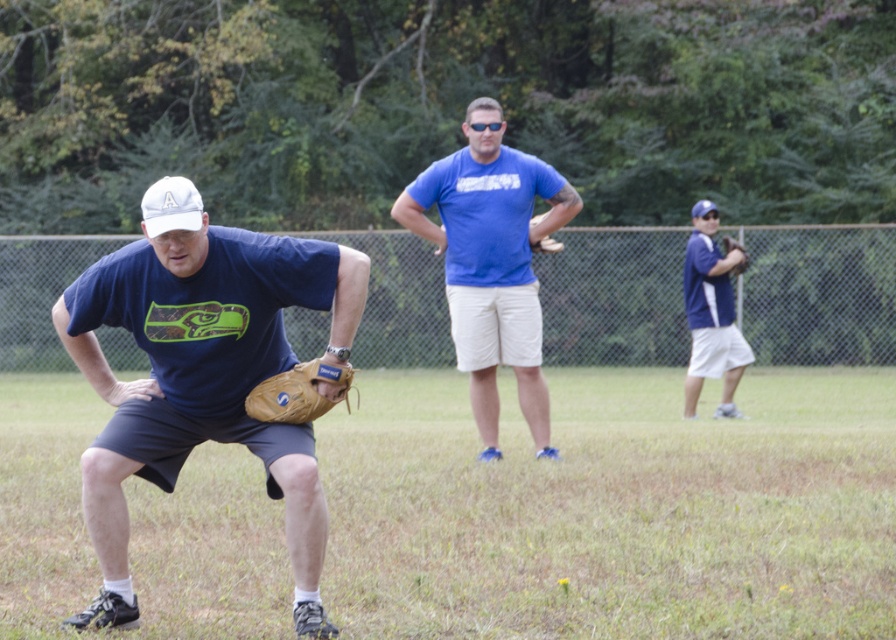
Between brown leather baseball glove at center and brown leather glove at center, which one is positioned higher?

brown leather glove at center is above.

Does brown leather baseball glove at center have a smaller size compared to brown leather glove at center?

Yes.

Locate an element on the screen. This screenshot has width=896, height=640. brown leather baseball glove at center is located at coordinates (297, 392).

Who is taller, dark blue baseball glove at center or white matte baseball cap at left?

white matte baseball cap at left

Does point (165, 586) come behind point (186, 212)?

Yes, it is.

The height and width of the screenshot is (640, 896). Find the location of `dark blue baseball glove at center`. dark blue baseball glove at center is located at coordinates (614, 508).

Find the location of `dark blue baseball glove at center`. dark blue baseball glove at center is located at coordinates pyautogui.click(x=614, y=508).

How much distance is there between matte blue t-shirt at left and blue cotton shirt at center?

They are 4.17 meters apart.

In the scene shown: Is matte blue t-shirt at left positioned in front of blue cotton shirt at center?

That is True.

You are a GUI agent. You are given a task and a screenshot of the screen. Output one action in this format:
    pyautogui.click(x=<x>, y=<y>)
    Task: Click on the matte blue t-shirt at left
    The image size is (896, 640).
    Given the screenshot: What is the action you would take?
    pyautogui.click(x=205, y=381)